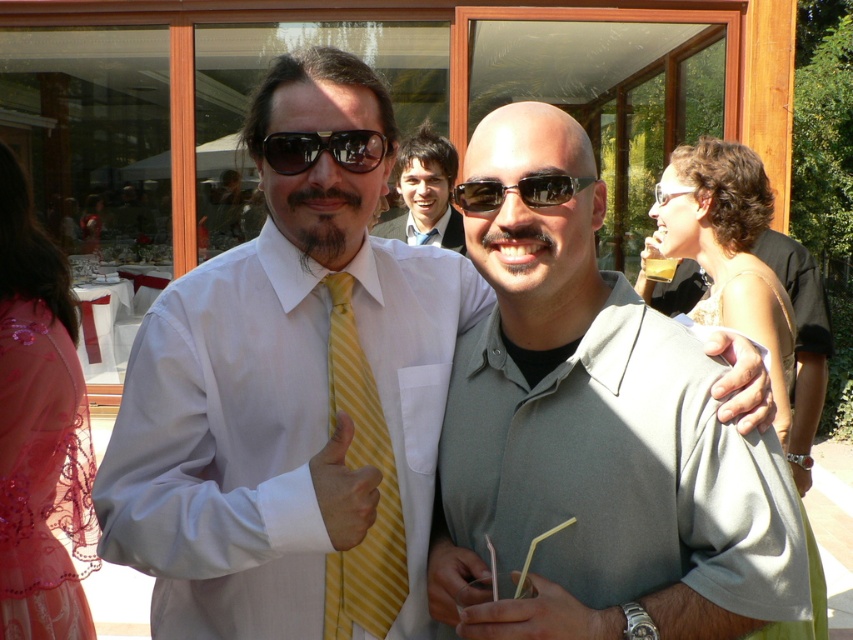
Is matte gray polo shirt at center above yellow striped tie at center?

Indeed, matte gray polo shirt at center is positioned over yellow striped tie at center.

Who is more distant from viewer, (579,154) or (358,614)?

Point (358,614)

Identify the location of matte gray polo shirt at center. (606, 445).

Who is lower down, yellow striped tie at center or black matte sunglasses at center?

yellow striped tie at center

Can you confirm if yellow striped tie at center is taller than black matte sunglasses at center?

Yes.

Does point (390, 625) come farther from viewer compared to point (518, 186)?

Yes, point (390, 625) is farther from viewer.

The width and height of the screenshot is (853, 640). What are the coordinates of `yellow striped tie at center` in the screenshot? It's located at (378, 486).

Is pink sequined dress at left thinner than smooth beige hand at center?

In fact, pink sequined dress at left might be wider than smooth beige hand at center.

Consider the image. Who is positioned more to the right, pink sequined dress at left or smooth beige hand at center?

smooth beige hand at center

Which is behind, point (41, 376) or point (437, 550)?

The point (41, 376) is more distant.

This screenshot has width=853, height=640. In order to click on pink sequined dress at left in this screenshot , I will do `click(39, 474)`.